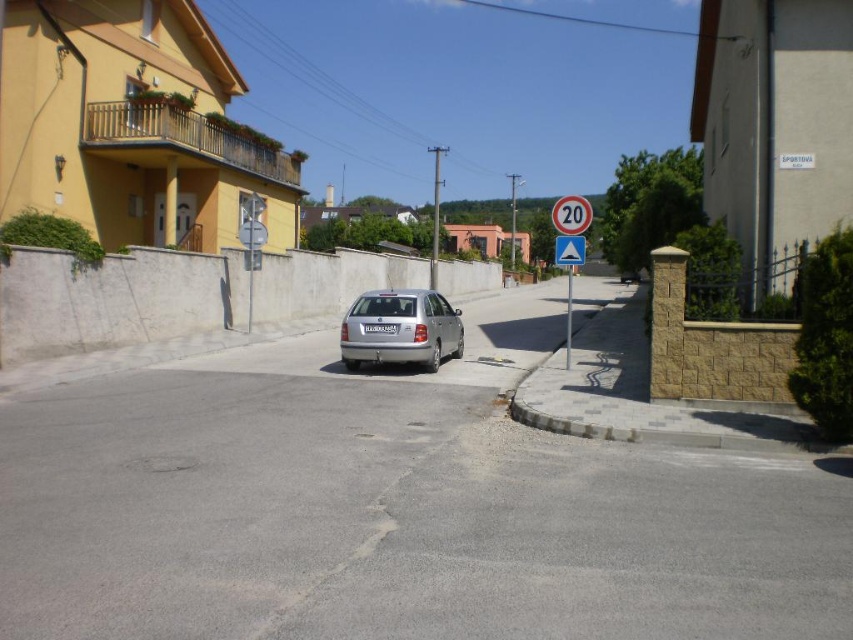
You are standing at the point with coordinates 0.5, 0.5 in this image. You want to walk to the silver metallic car at center. In which direction should you move relative to your current position?

Since the car is located at coordinates [399,328] and you are at [426,320], you should move slightly to the right and down to reach the silver metallic car at center.

You are standing at the center of the road in the residential street scene. There are two points marked on the road surface, one at coordinates point (x=339, y=337) and the other at point (x=578, y=236). Which point is closer to you?

Point (x=339, y=337) is closer to you because it is further to the viewer than point (x=578, y=236).

You are driving a car and see the silver metallic car at center and the reflective plastic yield sign at center. Which object is positioned lower in the image?

The silver metallic car at center is located below the reflective plastic yield sign at center, so the silver metallic car at center is positioned lower in the image.